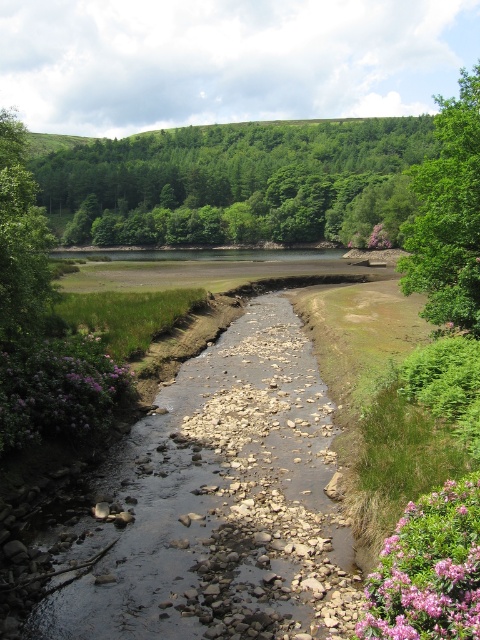
You are standing at the origin point in the image, which is the bottom left corner. The green leafy trees at upper center are located at coordinates 0.286, 0.498. If you want to walk directly towards them, in which direction should you move?

To reach the green leafy trees at upper center located at coordinates (239,182) from the origin at the bottom left corner, you should move northeast. This is because the x coordinate 0.286 indicates a rightward direction and the y coordinate 0.498 indicates an upward direction.

You are standing at the point closest to the bottom of the image and want to cross the stream to the other side. There are two points marked on the stream bed that you can use as stepping stones. The points are labeled as point(88, 381) and point(2, 256). Which point should you step on first to reach the other side?

You should step on point(2, 256) first because it is closer to your starting position at the bottom of the image than point(88, 381), which is behind it.

You are standing at the origin point of the image, which is the bottom left corner. You want to walk to the purple fuzzy bush at lower left. In which direction should you move?

Since the purple fuzzy bush at lower left is located at point (56,388), which is to the right and slightly forward from the origin, you should move towards the right and forward direction to reach it.